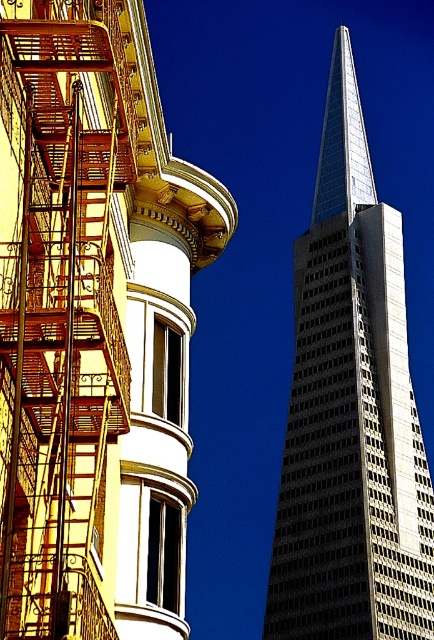
Can you confirm if rusty metal fire escape at left is wider than glassy silver skyscraper at center?

Incorrect, rusty metal fire escape at left's width does not surpass glassy silver skyscraper at center's.

Consider the image. Does rusty metal fire escape at left have a smaller size compared to glassy silver skyscraper at center?

Correct, rusty metal fire escape at left occupies less space than glassy silver skyscraper at center.

Is point (36, 332) positioned after point (375, 406)?

No, (36, 332) is in front of (375, 406).

The width and height of the screenshot is (434, 640). In order to click on rusty metal fire escape at left in this screenshot , I will do `click(62, 314)`.